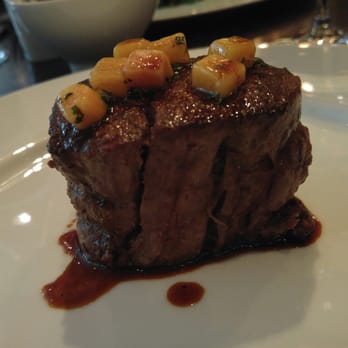
At what (x,y) coordinates should I click in order to perform the action: click on sauce on plate. Please return your answer as a coordinate pair (x, y). The width and height of the screenshot is (348, 348). Looking at the image, I should click on (73, 281), (69, 238), (179, 291), (317, 234).